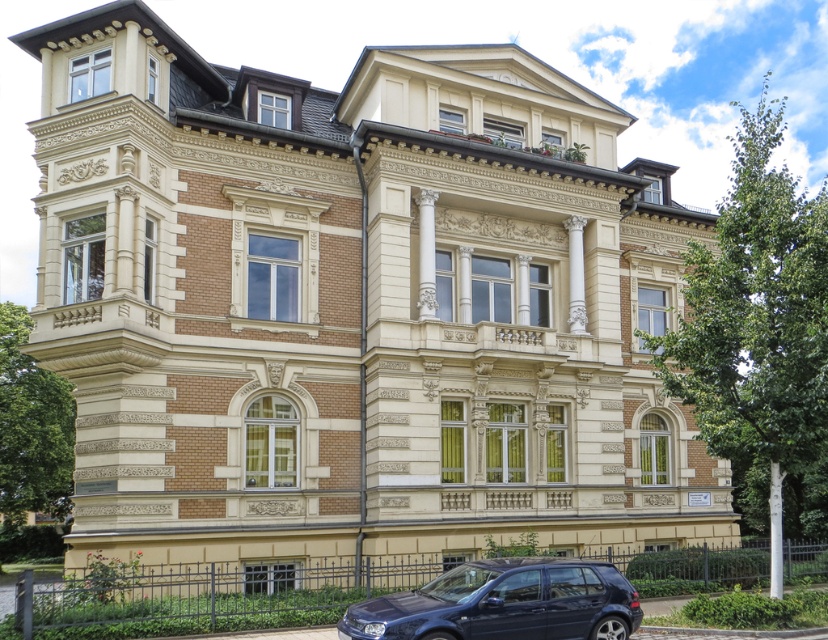
Does green grass at lower center have a greater height compared to glossy dark blue car at lower center?

Yes, green grass at lower center is taller than glossy dark blue car at lower center.

Which is in front, point (636, 573) or point (595, 625)?

Positioned in front is point (595, 625).

This screenshot has width=828, height=640. In order to click on green grass at lower center in this screenshot , I will do `click(205, 596)`.

Find the location of a particular element. Image resolution: width=828 pixels, height=640 pixels. green grass at lower center is located at coordinates (205, 596).